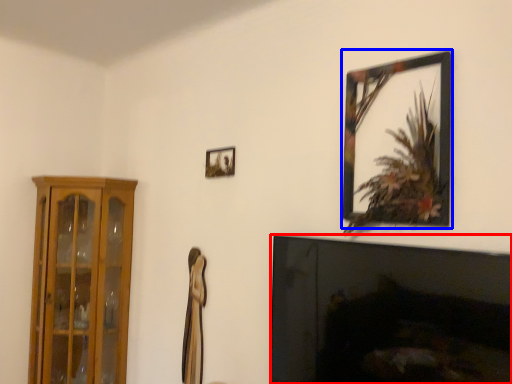
Question: Which of the following is the closest to the observer, fireplace (highlighted by a red box) or picture frame (highlighted by a blue box)?

Choices:
 (A) fireplace
 (B) picture frame

Answer: (A)